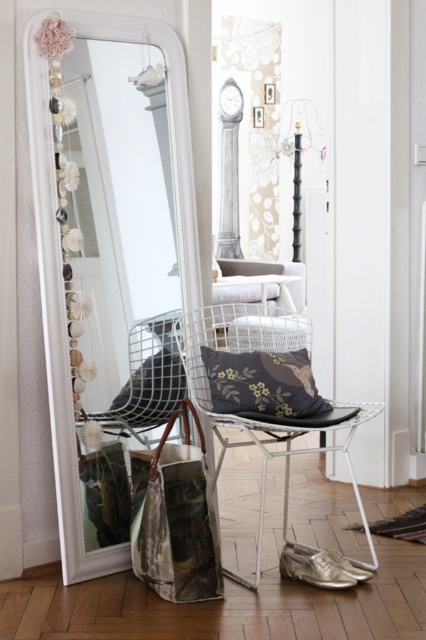
Can you confirm if dark floral-patterned cushion at center is bigger than white wire armchair at center?

Incorrect, dark floral-patterned cushion at center is not larger than white wire armchair at center.

This screenshot has height=640, width=426. Find the location of `dark floral-patterned cushion at center`. dark floral-patterned cushion at center is located at coordinates click(x=262, y=384).

Is point (279, 378) more distant than point (173, 371)?

No, (279, 378) is in front of (173, 371).

Where is `dark floral-patterned cushion at center`? Image resolution: width=426 pixels, height=640 pixels. dark floral-patterned cushion at center is located at coordinates (262, 384).

Does white wire armchair at center appear over white woven basket at center?

No, white wire armchair at center is not above white woven basket at center.

Does white wire armchair at center lie in front of white woven basket at center?

Yes, it is.

Describe the element at coordinates (146, 381) in the screenshot. I see `white wire armchair at center` at that location.

Locate an element on the screen. The width and height of the screenshot is (426, 640). white wire armchair at center is located at coordinates (146, 381).

Can you confirm if floral-patterned fabric pillow at center is positioned to the left of white wire stool at center?

Yes, floral-patterned fabric pillow at center is to the left of white wire stool at center.

Who is more distant from viewer, (x=126, y=396) or (x=294, y=332)?

The point (x=294, y=332) is behind.

Is point (149, 388) positioned after point (235, 339)?

No, it is in front of (235, 339).

At what (x,y) coordinates should I click in order to perform the action: click on floral-patterned fabric pillow at center. Please return your answer as a coordinate pair (x, y). The image size is (426, 640). Looking at the image, I should click on (150, 392).